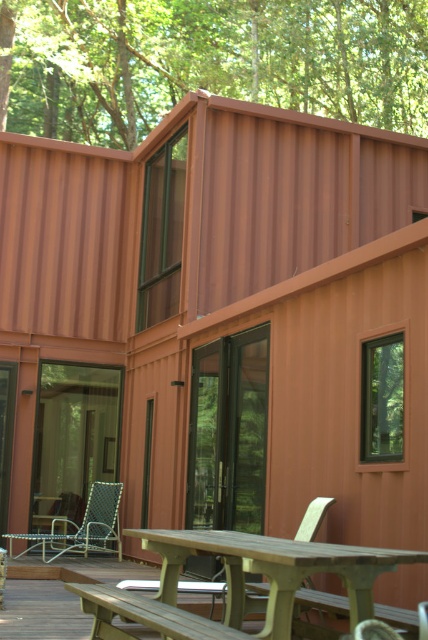
Which is more to the left, light brown wooden table at center or wooden bench at lower center?

wooden bench at lower center

In the scene shown: Which is above, light brown wooden table at center or wooden bench at lower center?

light brown wooden table at center

What are the coordinates of `light brown wooden table at center` in the screenshot? It's located at (273, 570).